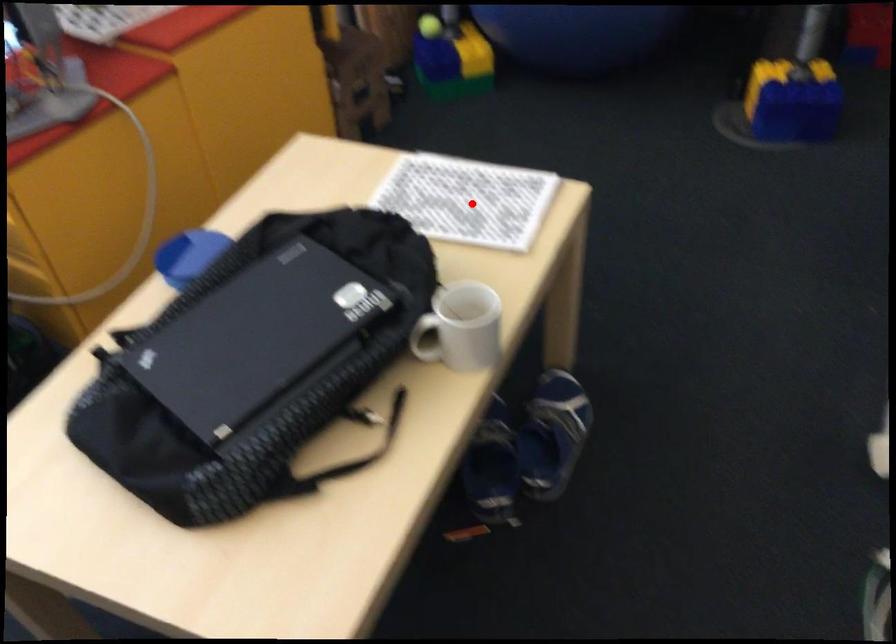
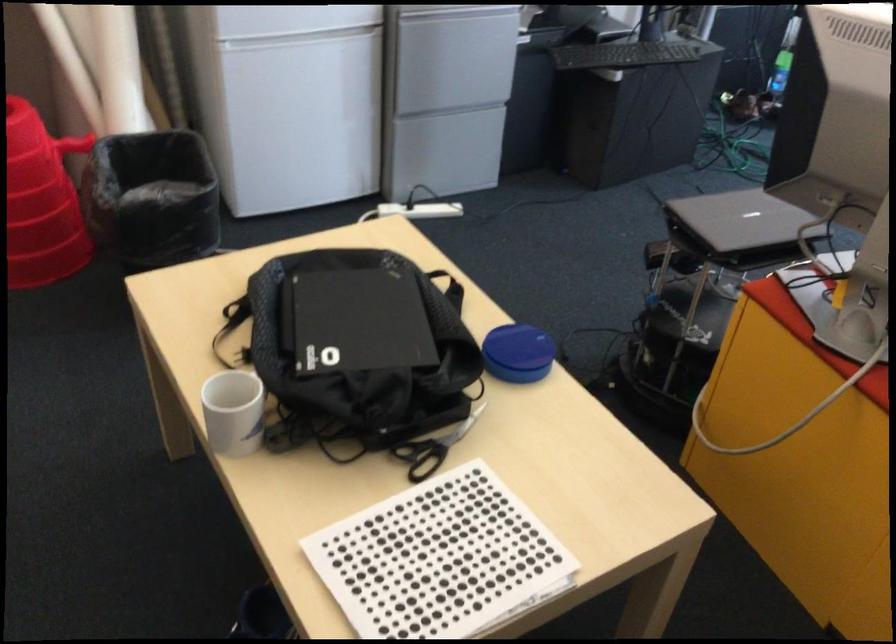
Where in the second image is the point corresponding to the highlighted location from the first image?

(440, 560)